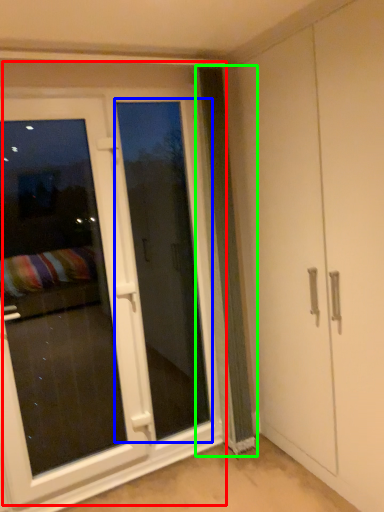
Question: Which object is positioned farthest from door (highlighted by a red box)? Select from screen door (highlighted by a blue box) and curtain (highlighted by a green box).

Choices:
 (A) screen door
 (B) curtain

Answer: (B)